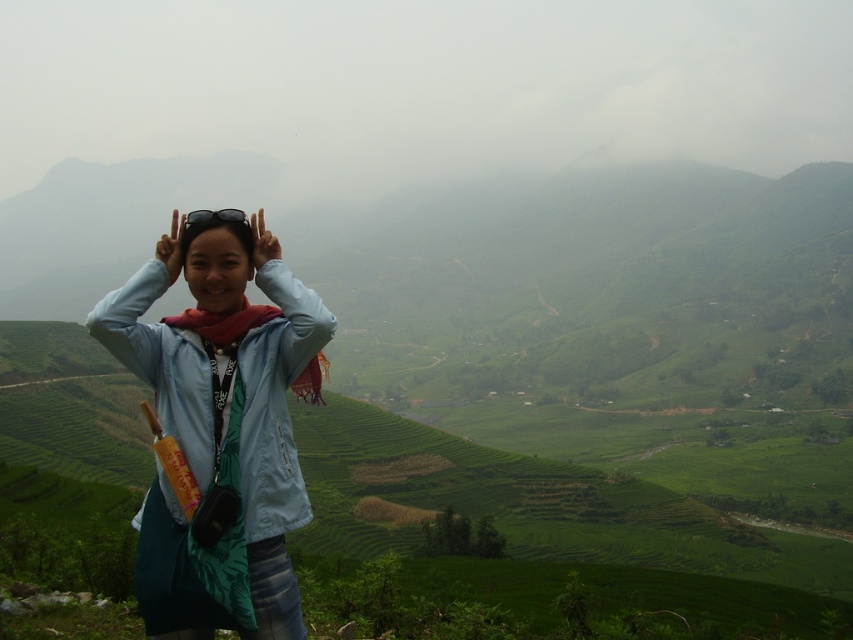
You are a fashion designer analyzing the clothing of a traveler in a tea plantation scene. The traveler is wearing a light blue fabric jacket at center and has a matte blue head at center. Which clothing item is wider?

The light blue fabric jacket at center is wider than the matte blue head at center because the light blue fabric jacket at center has a greater width.

You are a fashion designer observing the scene and want to create a new clothing line inspired by the light blue fabric jacket at center and the matte blue head at center. Which item would require more fabric to produce a similar size?

The light blue fabric jacket at center requires more fabric to produce a similar size because it is larger in size than the matte blue head at center.

Looking at this image, you are a fashion designer observing the image of a person wearing a light blue fabric jacket at center and a matte blue head at center. Which item of clothing is taller?

The light blue fabric jacket at center is taller than the matte blue head at center.